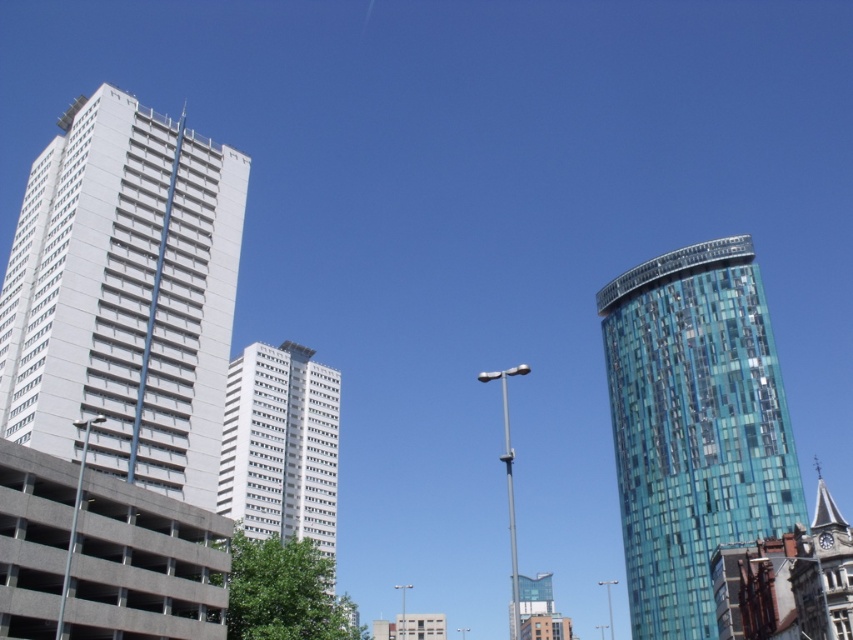
You are an architect designing a new city park between the white smooth building at left and the white glass building at center. Which building should the park be closer to if you want to ensure it receives more sunlight throughout the day?

The park should be closer to the white glass building at center because the white smooth building at left is taller and would cast a larger shadow, reducing sunlight availability.

You are a city planner assessing building heights for a new project. You observe the white smooth building at left and the blue glassy tower at right in the cityscape. Which building is taller?

The blue glassy tower at right is taller than the white smooth building at left.